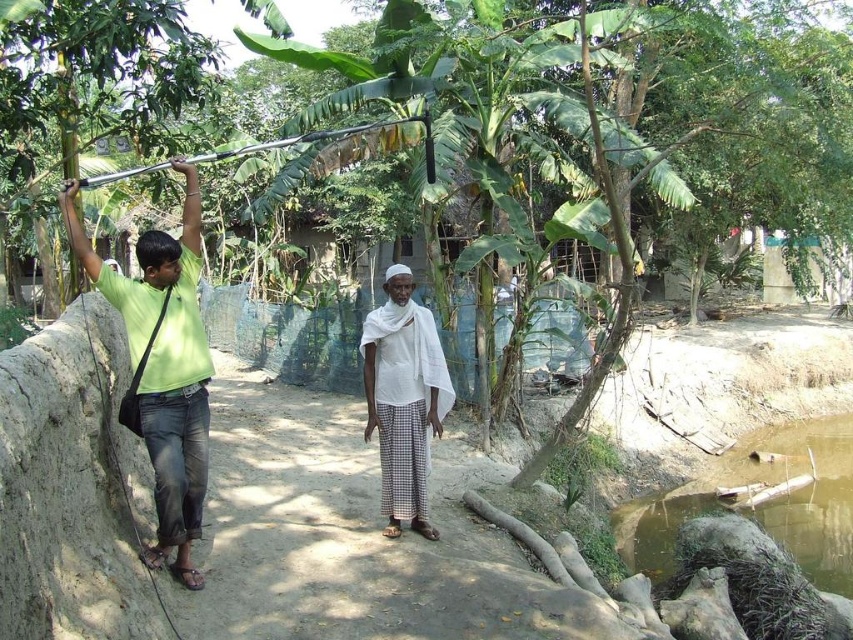
You are standing at the point marked by the coordinates point (x=164, y=365). Looking around, you see a green matte shirt at left and a white checkered garment at right. Which direction should you move to reach the person wearing the white checkered garment at right?

The point (x=164, y=365) corresponds to the green matte shirt at left. To reach the person wearing the white checkered garment at right, you should move to the right.

You are standing in a rural area with two people near a water body. You need to locate the green matte shirt at left. Where exactly is it positioned in terms of coordinates?

The green matte shirt at left is located at coordinates point (164, 365).